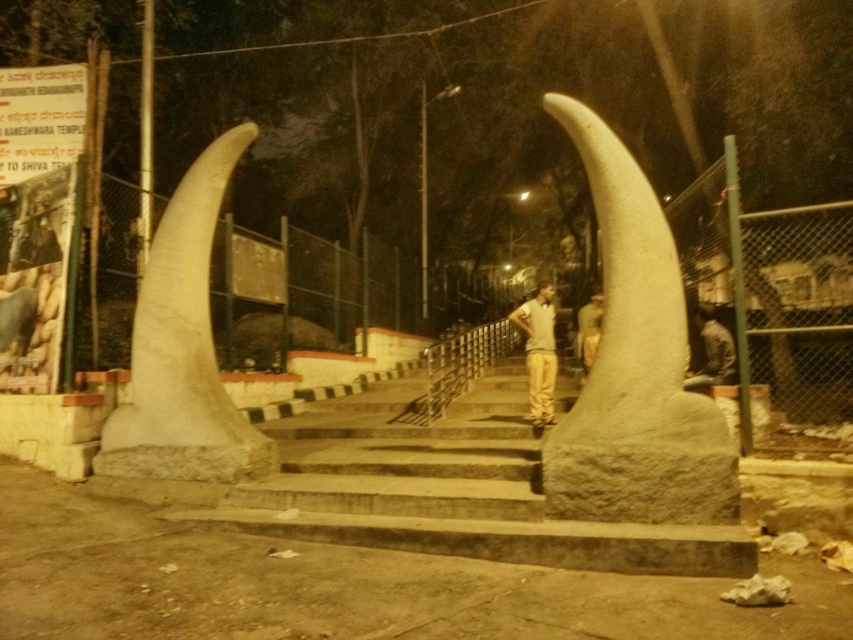
Question: Is dark gray fabric at lower right to the right of green fabric uniform at center from the viewer's perspective?

Choices:
 (A) yes
 (B) no

Answer: (A)

Question: Which of these objects is positioned closest to the dark gray fabric at lower right?

Choices:
 (A) green fabric uniform at center
 (B) light beige pants at center
 (C) white stone tusk at left
 (D) white stone tusk at center

Answer: (B)

Question: Which of the following is the closest to the observer?

Choices:
 (A) green fabric uniform at center
 (B) white stone tusk at left

Answer: (B)

Question: Is white stone tusk at left to the right of light beige pants at center from the viewer's perspective?

Choices:
 (A) no
 (B) yes

Answer: (A)

Question: Is white stone tusk at left smaller than light beige pants at center?

Choices:
 (A) no
 (B) yes

Answer: (B)

Question: Which point is closer to the camera?

Choices:
 (A) (529, 376)
 (B) (590, 358)
 (C) (155, 360)
 (D) (698, 372)

Answer: (C)